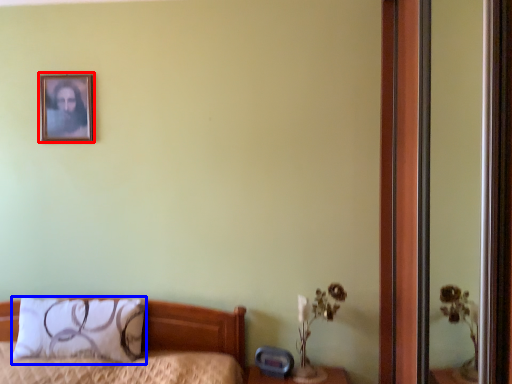
Question: Which point is further to the camera, picture frame (highlighted by a red box) or pillow (highlighted by a blue box)?

Choices:
 (A) picture frame
 (B) pillow

Answer: (A)